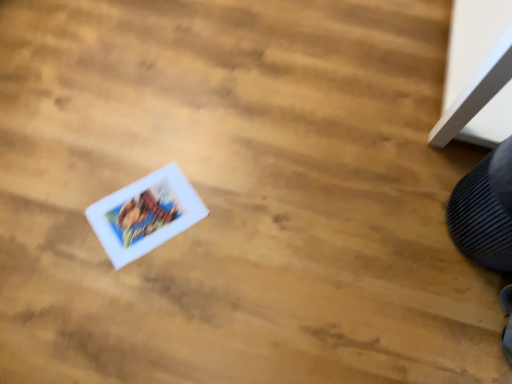
Locate an element on the screen. This screenshot has height=384, width=512. free space in front of white matte comic book at center is located at coordinates (133, 294).